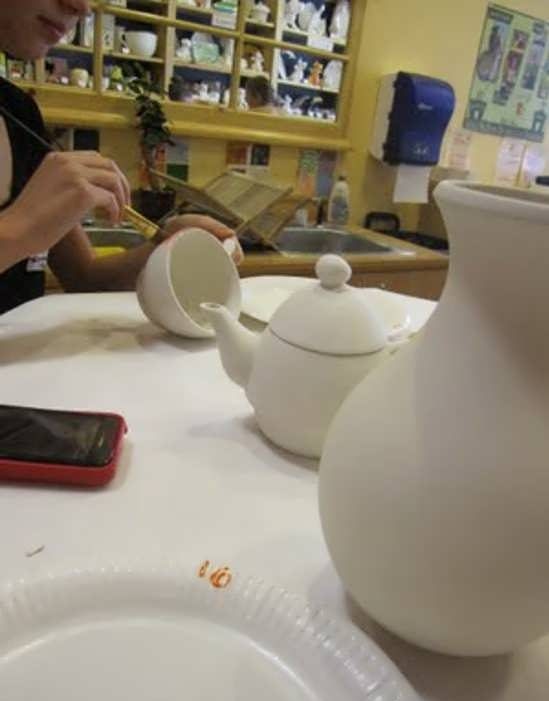
The image size is (549, 701). In order to click on paper towel dispenser in this screenshot , I will do `click(432, 107)`.